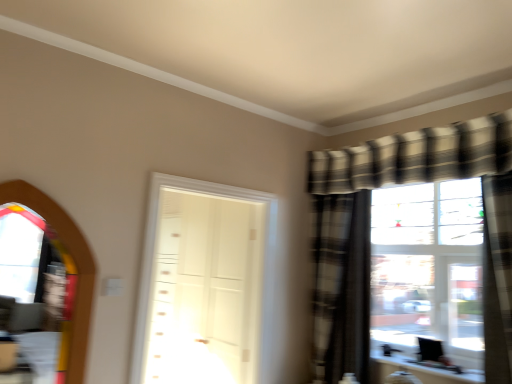
Question: Can you confirm if transparent glass window screen at left is positioned to the left of white glossy door at center?

Choices:
 (A) no
 (B) yes

Answer: (B)

Question: Can we say transparent glass window screen at left lies outside white glossy door at center?

Choices:
 (A) yes
 (B) no

Answer: (A)

Question: Is transparent glass window screen at left thinner than white glossy door at center?

Choices:
 (A) yes
 (B) no

Answer: (A)

Question: Considering the relative sizes of transparent glass window screen at left and white glossy door at center in the image provided, is transparent glass window screen at left taller than white glossy door at center?

Choices:
 (A) no
 (B) yes

Answer: (A)

Question: Is transparent glass window screen at left shorter than white glossy door at center?

Choices:
 (A) yes
 (B) no

Answer: (A)

Question: Looking at their shapes, would you say plaid fabric curtain at right, the 2th curtain viewed from the right, is wider or thinner than transparent glass window screen at left?

Choices:
 (A) wide
 (B) thin

Answer: (A)

Question: Would you say plaid fabric curtain at right, the 2th curtain viewed from the front, is to the left or to the right of transparent glass window screen at left in the picture?

Choices:
 (A) left
 (B) right

Answer: (B)

Question: Is plaid fabric curtain at right, arranged as the 1th curtain when viewed from the back, spatially inside transparent glass window screen at left, or outside of it?

Choices:
 (A) outside
 (B) inside

Answer: (A)

Question: From their relative heights in the image, would you say plaid fabric curtain at right, the 2th curtain viewed from the right, is taller or shorter than transparent glass window screen at left?

Choices:
 (A) tall
 (B) short

Answer: (A)

Question: Is plaid fabric curtain at right, the 2th curtain viewed from the front, wider or thinner than plaid fabric curtain at right, the second curtain viewed from the left?

Choices:
 (A) thin
 (B) wide

Answer: (A)

Question: Considering the positions of plaid fabric curtain at right, arranged as the 1th curtain when viewed from the back, and plaid fabric curtain at right, the second curtain viewed from the left, in the image, is plaid fabric curtain at right, arranged as the 1th curtain when viewed from the back, taller or shorter than plaid fabric curtain at right, the second curtain viewed from the left,?

Choices:
 (A) short
 (B) tall

Answer: (B)

Question: From a real-world perspective, is plaid fabric curtain at right, the 2th curtain viewed from the front, physically located above or below plaid fabric curtain at right, placed as the first curtain when sorted from right to left?

Choices:
 (A) above
 (B) below

Answer: (B)

Question: From the image's perspective, is plaid fabric curtain at right, the 2th curtain viewed from the front, located above or below plaid fabric curtain at right, the second curtain viewed from the left?

Choices:
 (A) below
 (B) above

Answer: (A)

Question: Considering the positions of point (18, 187) and point (135, 342), is point (18, 187) closer or farther from the camera than point (135, 342)?

Choices:
 (A) farther
 (B) closer

Answer: (B)

Question: Is transparent glass window screen at left to the left or to the right of white glossy door at center in the image?

Choices:
 (A) right
 (B) left

Answer: (B)